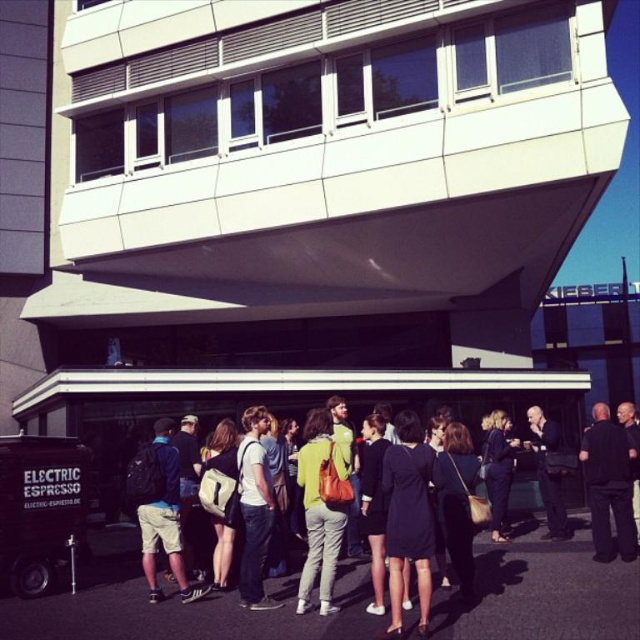
Which is more to the right, light blue denim shorts at lower left or dark blue dress at center?

Positioned to the right is dark blue dress at center.

Can you confirm if light blue denim shorts at lower left is positioned above dark blue dress at center?

Correct, light blue denim shorts at lower left is located above dark blue dress at center.

You are a GUI agent. You are given a task and a screenshot of the screen. Output one action in this format:
    pyautogui.click(x=<x>, y=<y>)
    Task: Click on the light blue denim shorts at lower left
    
    Given the screenshot: What is the action you would take?
    pyautogui.click(x=160, y=509)

This screenshot has width=640, height=640. In order to click on light blue denim shorts at lower left in this screenshot , I will do `click(160, 509)`.

From the picture: Can you confirm if dark blue leather jacket at lower right is shorter than dark blue dress at center?

Incorrect, dark blue leather jacket at lower right's height does not fall short of dark blue dress at center's.

Which is behind, point (564, 538) or point (484, 472)?

Positioned behind is point (484, 472).

Who is more forward, (552, 444) or (486, 440)?

Point (552, 444) is in front.

Identify the location of dark blue leather jacket at lower right. coord(550,470).

Which is below, matte black backpack at center or black dress at center?

matte black backpack at center is lower down.

Measure the distance between matte black backpack at center and camera.

A distance of 18.50 feet exists between matte black backpack at center and camera.

Image resolution: width=640 pixels, height=640 pixels. I want to click on matte black backpack at center, so click(x=545, y=596).